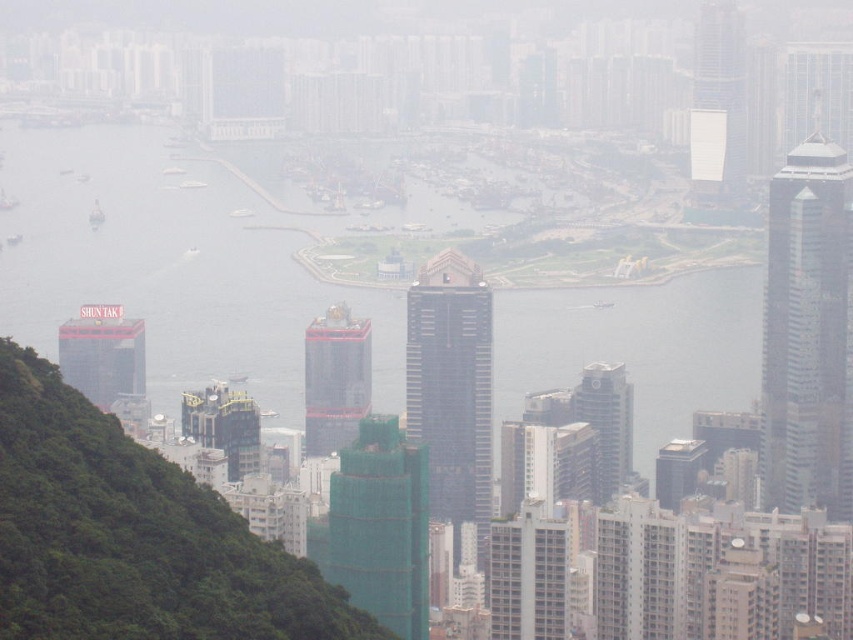
Question: Observing the image, what is the correct spatial positioning of dark gray glass skyscraper at center in reference to red glass building at left?

Choices:
 (A) below
 (B) above

Answer: (A)

Question: Can you confirm if dark gray glass skyscraper at center is smaller than red brick building at center?

Choices:
 (A) yes
 (B) no

Answer: (B)

Question: Is transparent water at center thinner than red glass building at left?

Choices:
 (A) yes
 (B) no

Answer: (B)

Question: Which object is farther from the camera taking this photo?

Choices:
 (A) glassy silver skyscraper at right
 (B) metallic glass building at center

Answer: (A)

Question: Which object is closer to the camera taking this photo?

Choices:
 (A) transparent water at center
 (B) red glass building at left
 (C) red brick building at center
 (D) green textured hillside at left

Answer: (A)

Question: Estimate the real-world distances between objects in this image. Which object is farther from the white glass tower at upper right?

Choices:
 (A) glassy silver skyscraper at right
 (B) dark gray glass skyscraper at center
 (C) metallic glass building at center
 (D) green mesh building at center

Answer: (D)